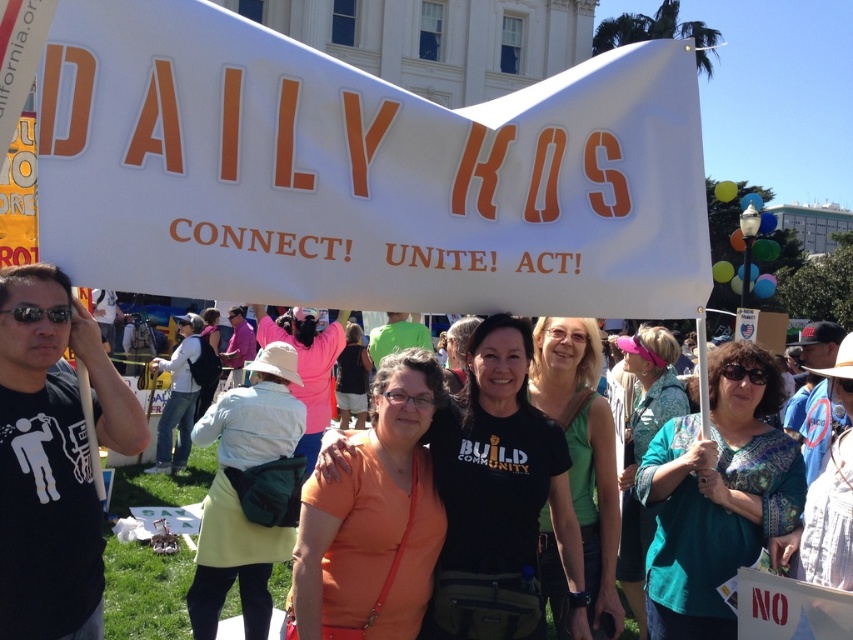
Image resolution: width=853 pixels, height=640 pixels. Find the location of `teal printed blouse at center`. teal printed blouse at center is located at coordinates (717, 496).

Find the location of `teal printed blouse at center`. teal printed blouse at center is located at coordinates (717, 496).

Can you confirm if teal fabric shirt at center is positioned below light green skirt at center?

Indeed, teal fabric shirt at center is positioned under light green skirt at center.

Where is `teal fabric shirt at center`? Image resolution: width=853 pixels, height=640 pixels. teal fabric shirt at center is located at coordinates (643, 449).

Is point (657, 369) more distant than point (201, 534)?

Yes, it is.

Locate an element on the screen. This screenshot has height=640, width=853. teal fabric shirt at center is located at coordinates (643, 449).

Is orange matte shirt at center smaller than matte black shirt at center?

Indeed, orange matte shirt at center has a smaller size compared to matte black shirt at center.

Who is positioned more to the left, orange matte shirt at center or matte black shirt at center?

matte black shirt at center

In the scene shown: Who is more forward, (335, 509) or (338, 400)?

Point (335, 509)

At what (x,y) coordinates should I click in order to perform the action: click on orange matte shirt at center. Please return your answer as a coordinate pair (x, y). The image size is (853, 640). Looking at the image, I should click on (374, 518).